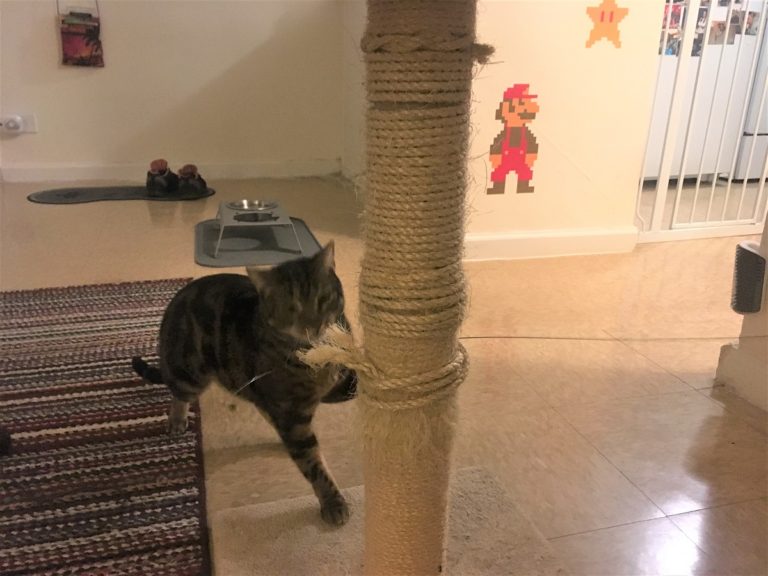
Image resolution: width=768 pixels, height=576 pixels. I want to click on rug, so click(121, 386).